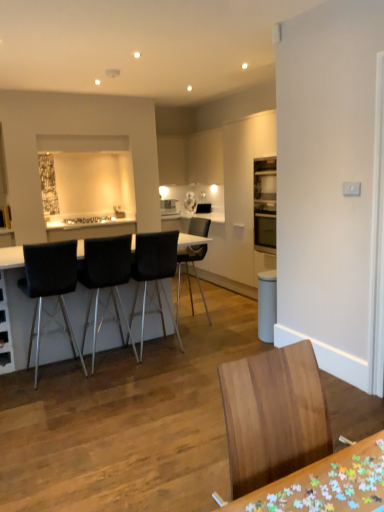
Question: Is wooden puzzle pieces at lower right, which appears as the 2th table when viewed from the back, in front of or behind black leather chair at left, the 2th chair from the front, in the image?

Choices:
 (A) behind
 (B) front

Answer: (B)

Question: Visually, is wooden puzzle pieces at lower right, which appears as the 2th table when viewed from the back, positioned to the left or to the right of black leather chair at left, the 2th chair from the front?

Choices:
 (A) right
 (B) left

Answer: (A)

Question: Estimate the real-world distances between objects in this image. Which object is farther from the black leather chair at left, the 2th chair from the front?

Choices:
 (A) white glossy microwave at upper center
 (B) black leather table at center, the 1th table from the left
 (C) wooden chair at center, the first chair viewed from the front
 (D) wooden puzzle pieces at lower right, the 1th table positioned from the bottom
 (E) black leather bar stool at left, the 3th chair when ordered from back to front

Answer: (A)

Question: Estimate the real-world distances between objects in this image. Which object is farther from the wooden puzzle pieces at lower right, which appears as the 2th table when viewed from the back?

Choices:
 (A) white glossy microwave at upper center
 (B) wooden chair at center, acting as the fifth chair starting from the back
 (C) black leather chair at center, the 2th chair viewed from the back
 (D) black leather chair at left, the 2th chair from the front
 (E) black leather table at center, the 1th table from the left

Answer: (A)